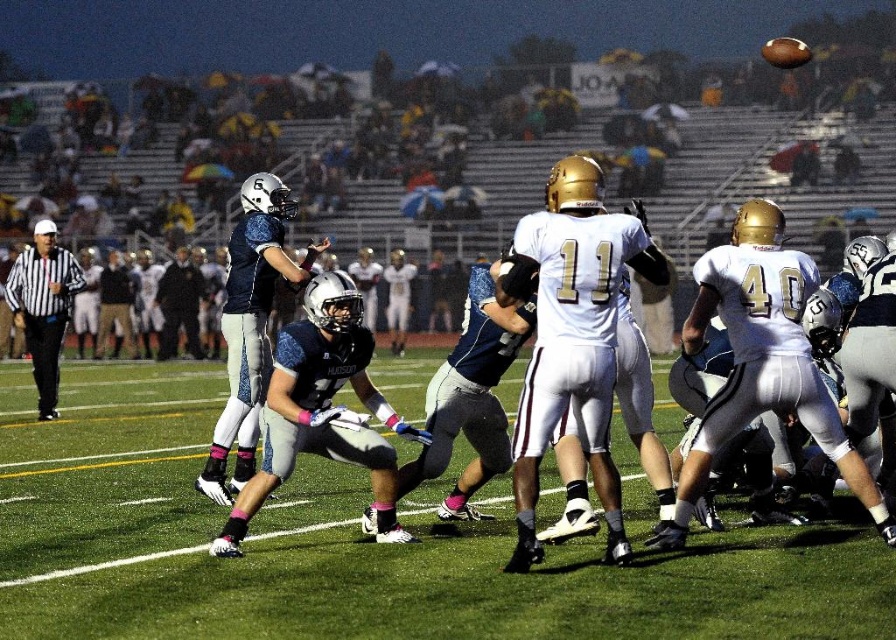
You are a player on the field and need to throw the ball to a teammate located at point (x=79, y=384). If your throwing range is 20 meters, can you reach them?

The point (x=79, y=384) is 19.77 meters away from you, so yes, you can reach them since it is within your 20 meter range.

You are a spectator at the football game. You notice the green grass football field at center and the black striped shirt at left. Which object is positioned lower in the image?

The green grass football field at center is positioned lower than the black striped shirt at left in the image.

You are a photographer standing at the edge of the field. You want to take a photo that includes both the green grass football field at center and the black striped shirt at left. Which object should you focus on first to ensure both are in frame?

The green grass football field at center is larger in size than the black striped shirt at left, so you should focus on the larger object first to ensure both are in frame.